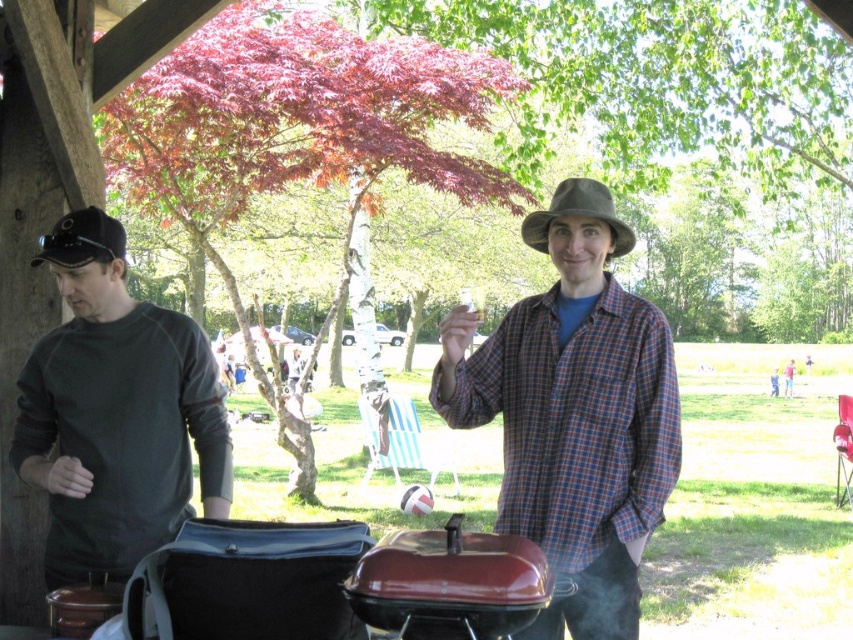
You are standing at the wooden pavilion and want to locate the plaid fabric shirt at center. According to the coordinates provided, where exactly should you look?

The plaid fabric shirt at center is located at point coordinates of 0.647 on the x axis and 0.674 on the y axis.